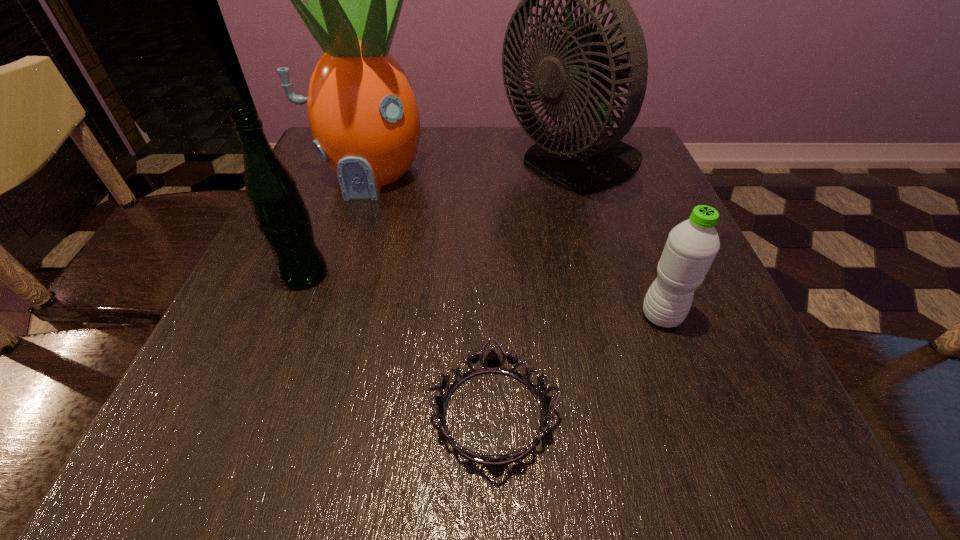
Image resolution: width=960 pixels, height=540 pixels. In order to click on free space between the pineapple and the nearest object in this screenshot , I will do (430, 294).

Point out which object is positioned as the second nearest to the beer bottle. Please provide its 2D coordinates. Your answer should be formatted as a tuple, i.e. [(x, y)], where the tuple contains the x and y coordinates of a point satisfying the conditions above.

[(492, 363)]

Identify the location of the second closest object to the pineapple. This screenshot has height=540, width=960. (585, 71).

Locate an element on the screen. This screenshot has width=960, height=540. free spot that satisfies the following two spatial constraints: 1. at the entrance of the pineapple; 2. on the left side of the water bottle is located at coordinates (321, 316).

Identify the location of blank area in the image that satisfies the following two spatial constraints: 1. in front of the fan to direct airflow; 2. at the entrance of the pineapple. coord(574,174).

I want to click on vacant space that satisfies the following two spatial constraints: 1. on the front side of the third tallest object; 2. on the right side of the second shortest object, so click(288, 316).